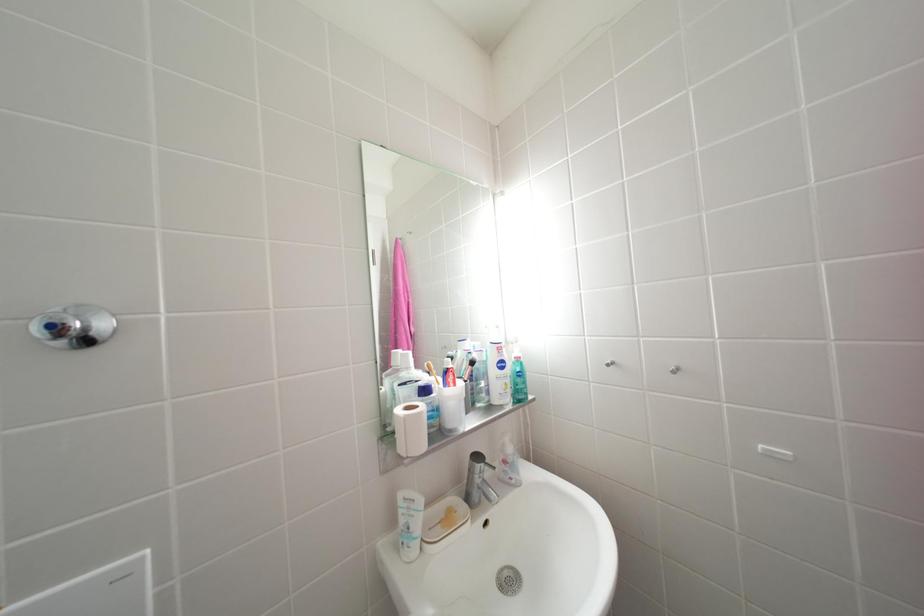
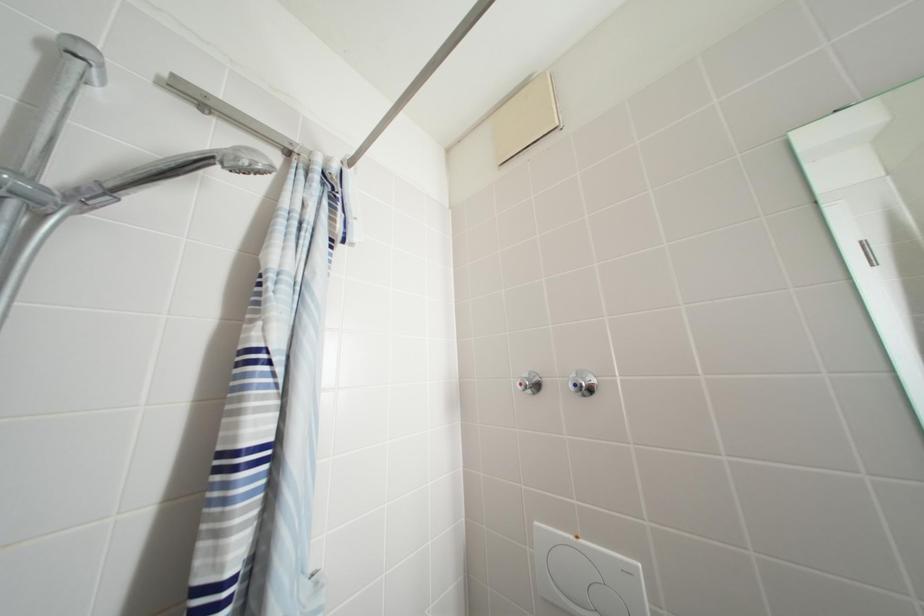
Question: The first image is from the beginning of the video and the second image is from the end. How did the camera likely rotate when shooting the video?

Choices:
 (A) Left
 (B) Right
 (C) Up
 (D) Down

Answer: (A)